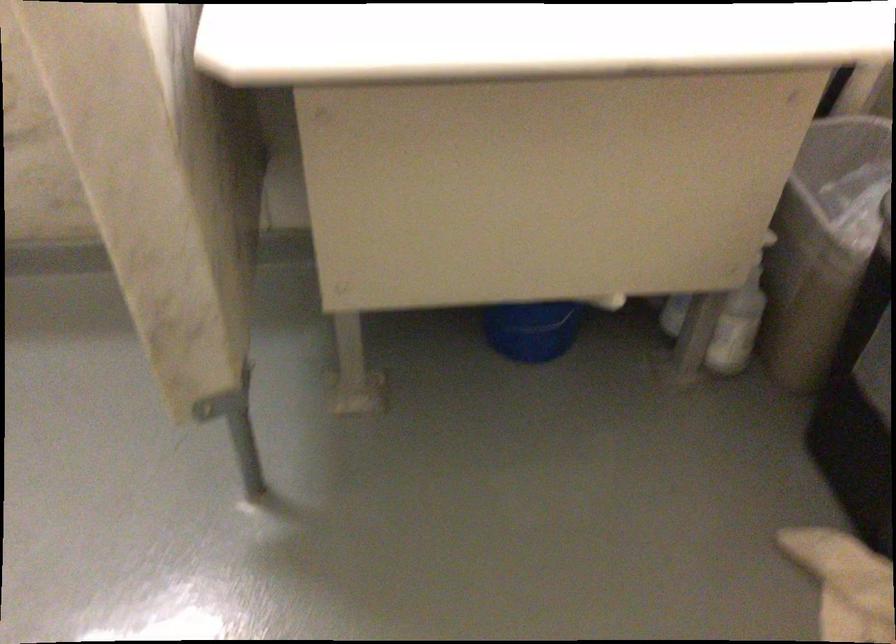
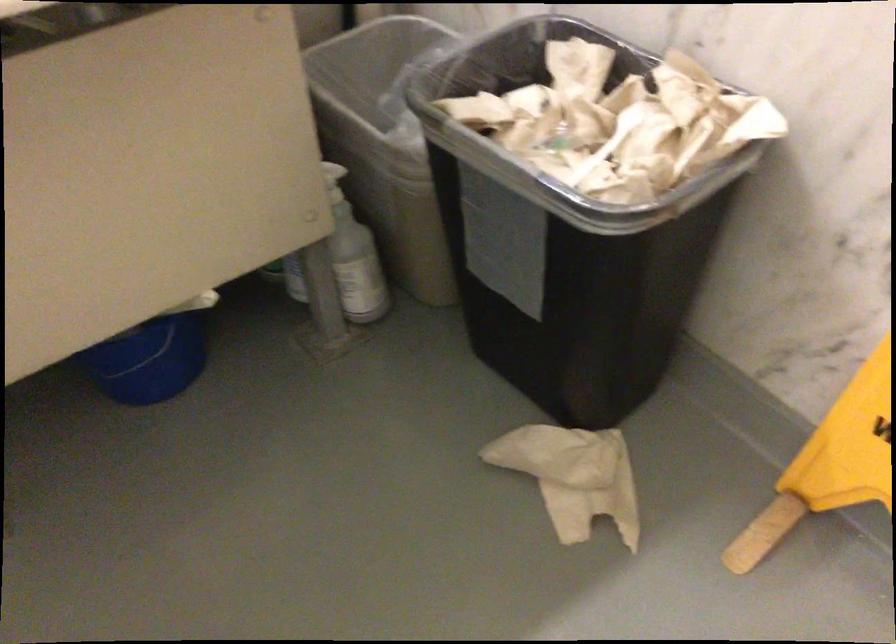
Locate, in the second image, the point that corresponds to [530,321] in the first image.

(149, 361)